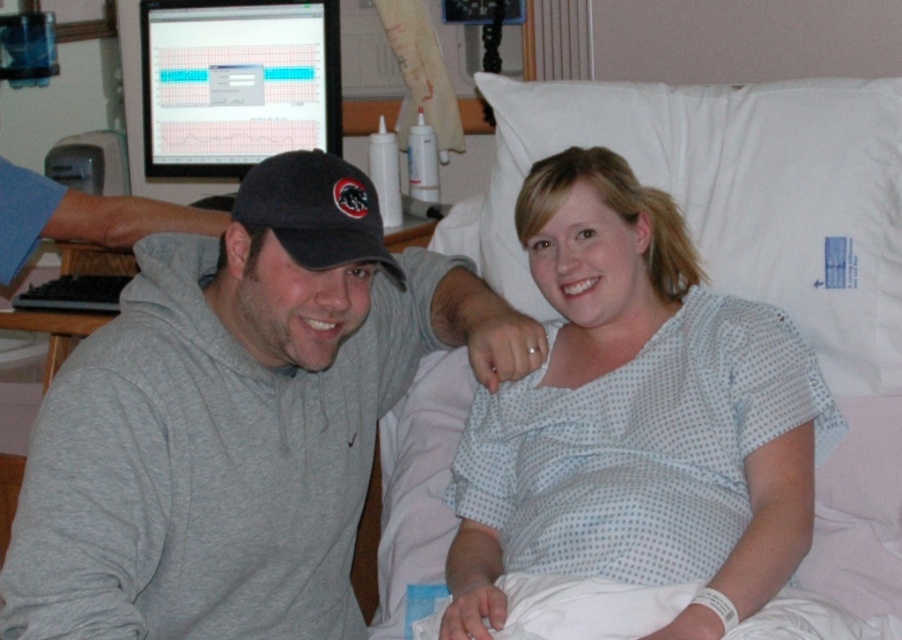
Between point (262, 1) and point (318, 166), which one is positioned in front?

Positioned in front is point (318, 166).

Does matte black monitor at upper left appear over black fabric baseball cap at center?

Correct, matte black monitor at upper left is located above black fabric baseball cap at center.

Which is in front, point (175, 177) or point (318, 248)?

Point (318, 248) is in front.

Find the location of a particular element. matte black monitor at upper left is located at coordinates (236, 83).

Who is more distant from viewer, (603,314) or (154,74)?

The point (154,74) is behind.

Between white dotted hospital gown at center and matte black monitor at upper left, which one is positioned higher?

matte black monitor at upper left is above.

Between point (670, 428) and point (249, 108), which one is positioned behind?

The point (249, 108) is more distant.

You are a GUI agent. You are given a task and a screenshot of the screen. Output one action in this format:
    pyautogui.click(x=<x>, y=<y>)
    Task: Click on the white dotted hospital gown at center
    
    Given the screenshot: What is the action you would take?
    pyautogui.click(x=636, y=419)

In the scene shown: Is gray hoodie at center smaller than white dotted hospital gown at center?

Actually, gray hoodie at center might be larger than white dotted hospital gown at center.

Between gray hoodie at center and white dotted hospital gown at center, which one has less height?

gray hoodie at center is shorter.

Who is more forward, (290, 230) or (703, 570)?

Point (290, 230)

Identify the location of gray hoodie at center. (238, 419).